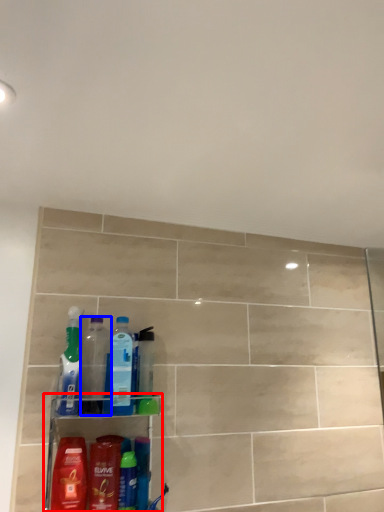
Question: Which point is further to the camera, shelf (highlighted by a red box) or bottle (highlighted by a blue box)?

Choices:
 (A) shelf
 (B) bottle

Answer: (B)